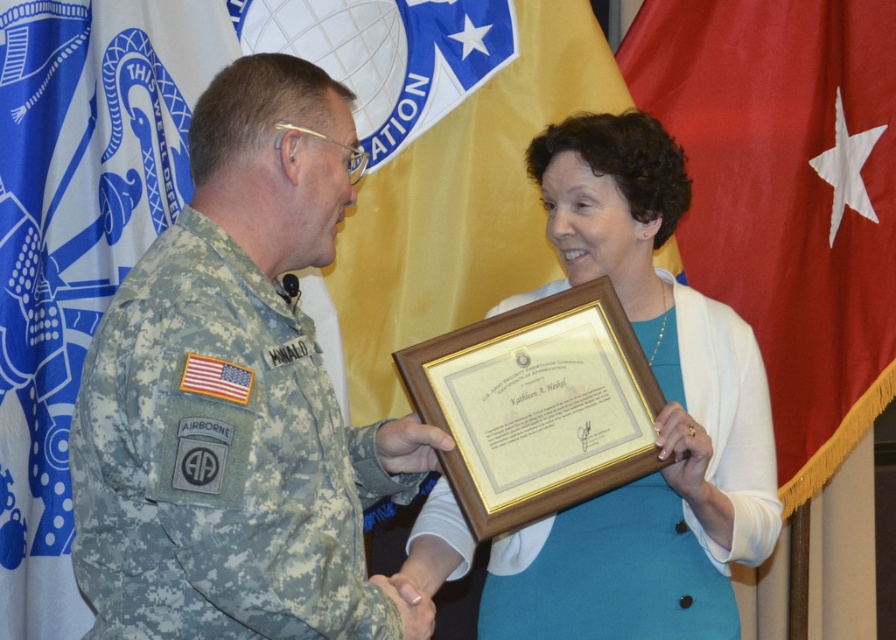
Is red fabric flag at right smaller than blue fabric flag at left?

Yes, red fabric flag at right is smaller than blue fabric flag at left.

Is red fabric flag at right above blue fabric flag at left?

Yes, red fabric flag at right is above blue fabric flag at left.

Between point (713, 188) and point (164, 42), which one is positioned behind?

Positioned behind is point (713, 188).

Image resolution: width=896 pixels, height=640 pixels. I want to click on red fabric flag at right, so click(x=787, y=196).

Between red fabric flag at right and wooden framed certificate at center, which one has more height?

With more height is red fabric flag at right.

Is the position of red fabric flag at right more distant than that of wooden framed certificate at center?

Yes.

This screenshot has height=640, width=896. I want to click on red fabric flag at right, so click(787, 196).

Is camouflage fabric uniform at left to the left of red fabric flag at right from the viewer's perspective?

Indeed, camouflage fabric uniform at left is positioned on the left side of red fabric flag at right.

Is point (264, 422) farther from viewer compared to point (750, 280)?

No, (264, 422) is in front of (750, 280).

Identify the location of camouflage fabric uniform at left. (220, 460).